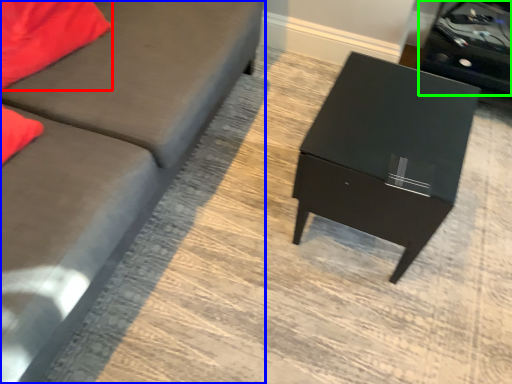
Question: Which object is positioned closest to pillow (highlighted by a red box)? Select from studio couch (highlighted by a blue box) and side table (highlighted by a green box).

Choices:
 (A) studio couch
 (B) side table

Answer: (A)